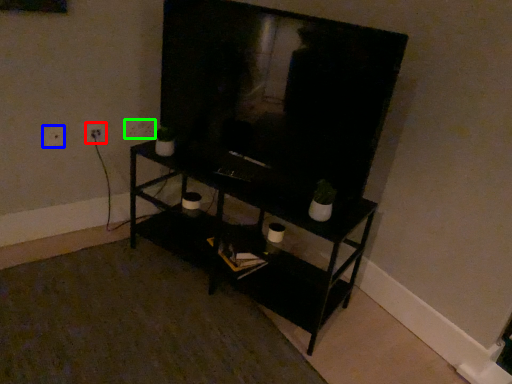
Question: Which object is positioned closest to electric outlet (highlighted by a red box)? Select from electric outlet (highlighted by a blue box) and electric outlet (highlighted by a green box).

Choices:
 (A) electric outlet
 (B) electric outlet

Answer: (A)